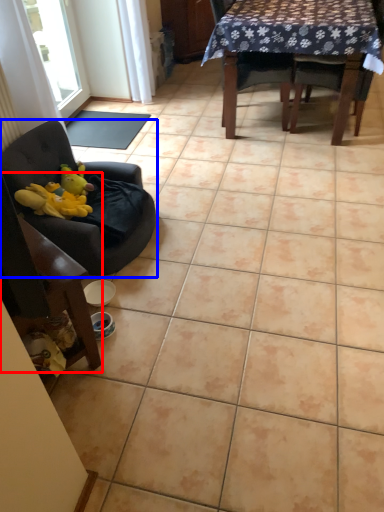
Question: Among these objects, which one is farthest to the camera, chair (highlighted by a red box) or chair (highlighted by a blue box)?

Choices:
 (A) chair
 (B) chair

Answer: (B)